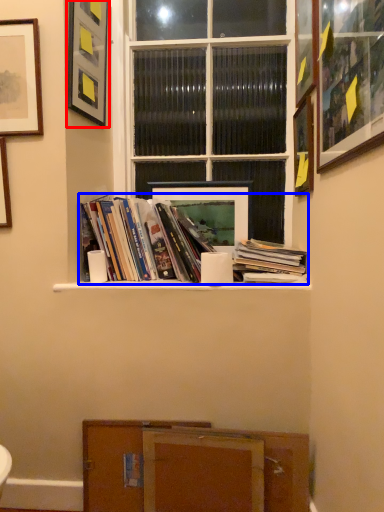
Question: Which object is closer to the camera taking this photo, picture frame (highlighted by a red box) or book (highlighted by a blue box)?

Choices:
 (A) picture frame
 (B) book

Answer: (A)